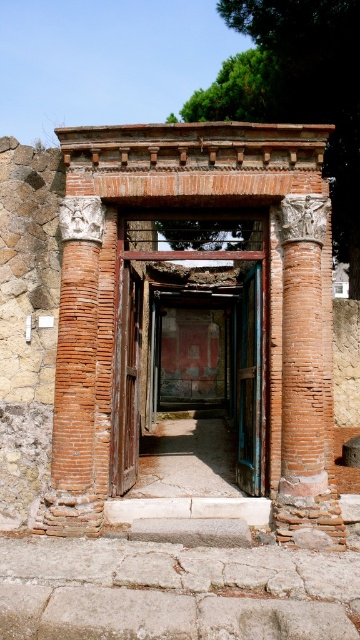
Does brick/reddish-brown stone archway at center appear on the left side of wooden slats door at center?

Incorrect, brick/reddish-brown stone archway at center is not on the left side of wooden slats door at center.

Find the location of `brick/reddish-brown stone archway at center`. brick/reddish-brown stone archway at center is located at coordinates (225, 321).

Which is in front, point (172, 228) or point (119, 291)?

Point (119, 291) is in front.

What do you see at coordinates (190, 333) in the screenshot?
I see `rustic wooden door at center` at bounding box center [190, 333].

The width and height of the screenshot is (360, 640). Identify the location of rustic wooden door at center. (190, 333).

Locate an element on the screen. The height and width of the screenshot is (640, 360). wooden slats door at center is located at coordinates (125, 380).

Who is lower down, wooden slats door at center or blue painted wood door at center?

blue painted wood door at center is below.

Where is `wooden slats door at center`? This screenshot has height=640, width=360. wooden slats door at center is located at coordinates (125, 380).

Locate an element on the screen. The height and width of the screenshot is (640, 360). wooden slats door at center is located at coordinates click(x=125, y=380).